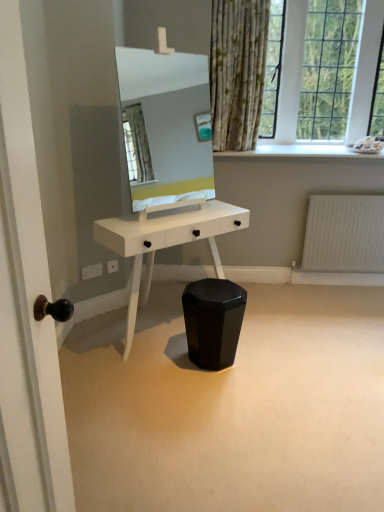
Describe the element at coordinates (26, 304) in the screenshot. I see `wooden door handle on the left` at that location.

What do you see at coordinates (231, 406) in the screenshot? The image size is (384, 512). I see `black glossy stool at center` at bounding box center [231, 406].

The height and width of the screenshot is (512, 384). What do you see at coordinates (344, 234) in the screenshot?
I see `white matte radiator at lower right` at bounding box center [344, 234].

Describe the element at coordinates (213, 321) in the screenshot. This screenshot has width=384, height=512. I see `black glossy stool at center` at that location.

This screenshot has width=384, height=512. What are the coordinates of `black glossy stool at center` in the screenshot? It's located at (213, 321).

Locate an element on the screen. The image size is (384, 512). wooden door handle on the left is located at coordinates (26, 304).

Between point (201, 295) and point (60, 470), which one is positioned in front?

The point (60, 470) is closer to the camera.

Which is correct: black glossy stool at center is inside wooden door handle on the left, or outside of it?

black glossy stool at center exists outside the volume of wooden door handle on the left.

From the image's perspective, is black glossy stool at center below wooden door handle on the left?

Yes, from the image's perspective, black glossy stool at center is below wooden door handle on the left.

In terms of height, does black glossy stool at center look taller or shorter compared to wooden door handle on the left?

Considering their sizes, black glossy stool at center has less height than wooden door handle on the left.

How many degrees apart are the facing directions of white matte radiator at lower right and white glossy table at center?

The angle between the facing direction of white matte radiator at lower right and the facing direction of white glossy table at center is 35.9 degrees.

From the picture: From a real-world perspective, is white matte radiator at lower right physically located above or below white glossy table at center?

white matte radiator at lower right is situated lower than white glossy table at center in the real world.

Is white matte radiator at lower right further to camera compared to white glossy table at center?

Yes, white matte radiator at lower right is behind white glossy table at center.

Where is `table lying below the white matte radiator at lower right (from the image's perspective)`? The height and width of the screenshot is (512, 384). table lying below the white matte radiator at lower right (from the image's perspective) is located at coordinates (165, 243).

Is white glossy table at center aimed at white matte radiator at lower right?

No, white glossy table at center is not aimed at white matte radiator at lower right.

From a real-world perspective, which object rests below the other?

white matte radiator at lower right, from a real-world perspective.

How far apart are white glossy table at center and white matte radiator at lower right?

white glossy table at center and white matte radiator at lower right are 3.80 feet apart.

In terms of width, does white glossy mirror at center look wider or thinner when compared to white matte radiator at lower right?

white glossy mirror at center is wider than white matte radiator at lower right.

From a real-world perspective, is white glossy mirror at center positioned above or below white matte radiator at lower right?

white glossy mirror at center is above white matte radiator at lower right.

Is white glossy mirror at center closer to the viewer compared to white matte radiator at lower right?

Yes, it is.

You are a GUI agent. You are given a task and a screenshot of the screen. Output one action in this format:
    pyautogui.click(x=<x>, y=<y>)
    Task: Click on the door that appears in front of the white matte radiator at lower right
    
    Given the screenshot: What is the action you would take?
    pyautogui.click(x=26, y=304)

Considering the sizes of objects wooden door handle on the left and white matte radiator at lower right in the image provided, who is wider, wooden door handle on the left or white matte radiator at lower right?

wooden door handle on the left is wider.

Consider the image. Are wooden door handle on the left and white matte radiator at lower right located far from each other?

Yes.

Is black glossy stool at center shorter than wooden door handle on the left?

Indeed, black glossy stool at center has a lesser height compared to wooden door handle on the left.

Is there a large distance between black glossy stool at center and wooden door handle on the left?

Yes, black glossy stool at center and wooden door handle on the left are quite far apart.

Where is `plain below the wooden door handle on the left (from a real-world perspective)`? plain below the wooden door handle on the left (from a real-world perspective) is located at coordinates (231, 406).

Is white matte radiator at lower right placed right next to wooden door handle on the left?

white matte radiator at lower right and wooden door handle on the left are clearly separated.

From a real-world perspective, between white matte radiator at lower right and wooden door handle on the left, who is vertically higher?

In real-world perspective, wooden door handle on the left is above.

Which of these two, white matte radiator at lower right or wooden door handle on the left, is smaller?

white matte radiator at lower right.

The image size is (384, 512). I want to click on door above the black glossy stool at center (from a real-world perspective), so click(26, 304).

Locate an element on the screen. The width and height of the screenshot is (384, 512). radiator on the right of white glossy table at center is located at coordinates (344, 234).

Looking at the image, which one is located further to white glossy mirror at center, white matte radiator at lower right or wooden door handle on the left?

wooden door handle on the left.

When comparing their distances from black glossy stool at center, does white glossy mirror at center or clear glass window at upper right seem closer?

Based on the image, clear glass window at upper right appears to be nearer to black glossy stool at center.

Considering their positions, is wooden door handle on the left positioned further to black glossy stool at center than clear glass window at upper right?

clear glass window at upper right.

From the image, which object appears to be farther from clear glass window at upper right, white glossy table at center or white glossy mirror at center?

white glossy mirror at center lies further to clear glass window at upper right than the other object.

Which object lies nearer to the anchor point black glossy stool at center, white glossy table at center or wooden door handle on the left?

white glossy table at center.

Considering their positions, is wooden door handle on the left positioned closer to white glossy mirror at center than white glossy table at center?

white glossy table at center is closer to white glossy mirror at center.

Estimate the real-world distances between objects in this image. Which object is closer to black glossy stool at center, white glossy mirror at center or wooden door handle on the left?

wooden door handle on the left is closer to black glossy stool at center.

Based on their spatial positions, is white matte radiator at lower right or wooden door handle on the left further from clear glass window at upper right?

wooden door handle on the left is further to clear glass window at upper right.

This screenshot has width=384, height=512. In order to click on table located between black glossy stool at center and black glossy stool at center in the depth direction in this screenshot , I will do `click(165, 243)`.

The width and height of the screenshot is (384, 512). I want to click on swivel chair between wooden door handle on the left and clear glass window at upper right from front to back, so click(x=213, y=321).

Where is `swivel chair between white glossy mirror at center and black glossy stool at center vertically`? The width and height of the screenshot is (384, 512). swivel chair between white glossy mirror at center and black glossy stool at center vertically is located at coordinates (213, 321).

The image size is (384, 512). What are the coordinates of `radiator that lies between clear glass window at upper right and white glossy table at center from top to bottom` in the screenshot? It's located at (344, 234).